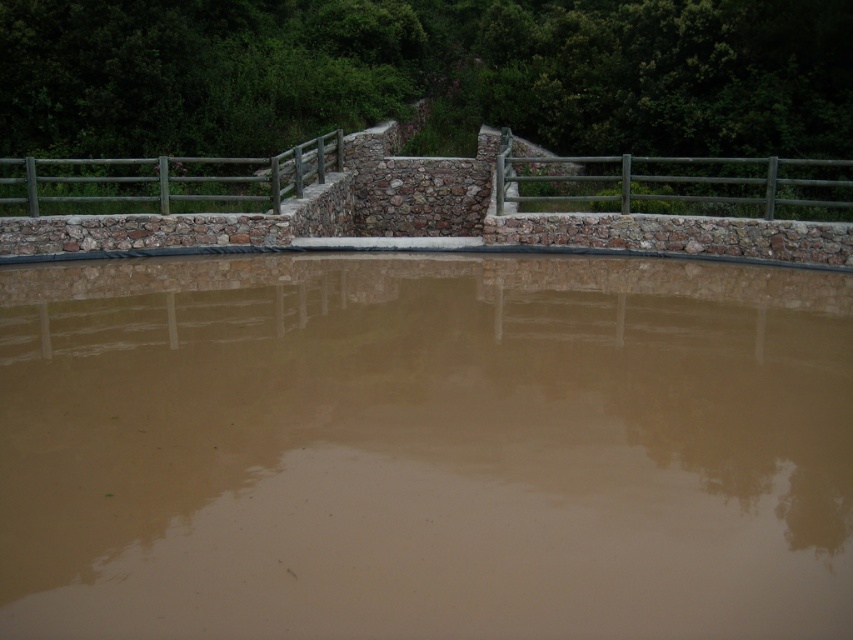
You are standing at the point with coordinates point (219, 196) and want to move to the point with coordinates point (773, 289). Given that you can only move forward in a straight line, will you pass by any objects along the way?

Since point (773, 289) is closer to the viewer than point (219, 196), moving from point (219, 196) to point (773, 289) would mean moving towards the background. However, the path between them would require moving through the stone wall and wooden fence in the middle ground, so yes, you would pass by the stone wall and wooden fence along the way.

You are a painter standing at the edge of the muddy water and want to paint both the green metallic rail at upper right and the green wooden rail at upper center. Which rail should you choose if you want to paint the smaller one first?

You should paint the green metallic rail at upper right first because it has a smaller size compared to the green wooden rail at upper center.

You are a photographer planning to capture the brown matte water at center and the green metallic rail at upper right in a single frame. Given their sizes, which object would appear more prominent in the photograph?

The brown matte water at center appears more prominent in the photograph because it has a larger size compared to the green metallic rail at upper right.